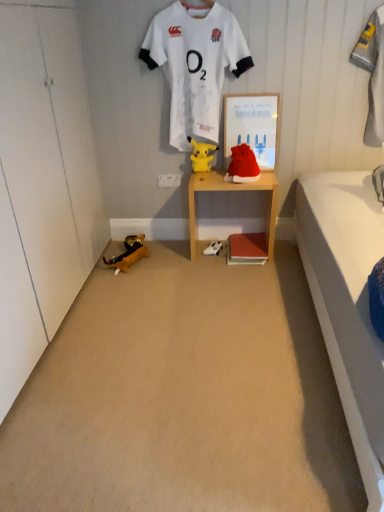
At what (x,y) coordinates should I click in order to perform the action: click on spots to the right of yellow plush toy at lower left, the 3th toy positioned from the right. Please return your answer as a coordinate pair (x, y). The image size is (384, 512). Looking at the image, I should click on (175, 257).